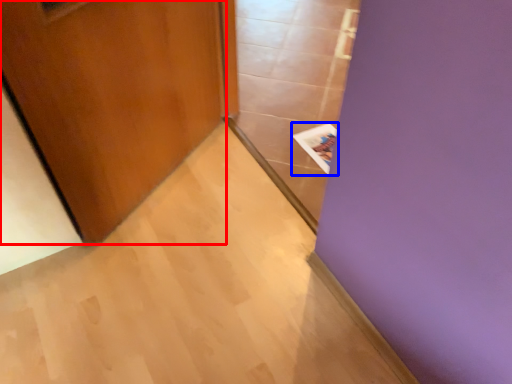
Question: Which point is closer to the camera, door (highlighted by a red box) or magazine (highlighted by a blue box)?

Choices:
 (A) door
 (B) magazine

Answer: (A)